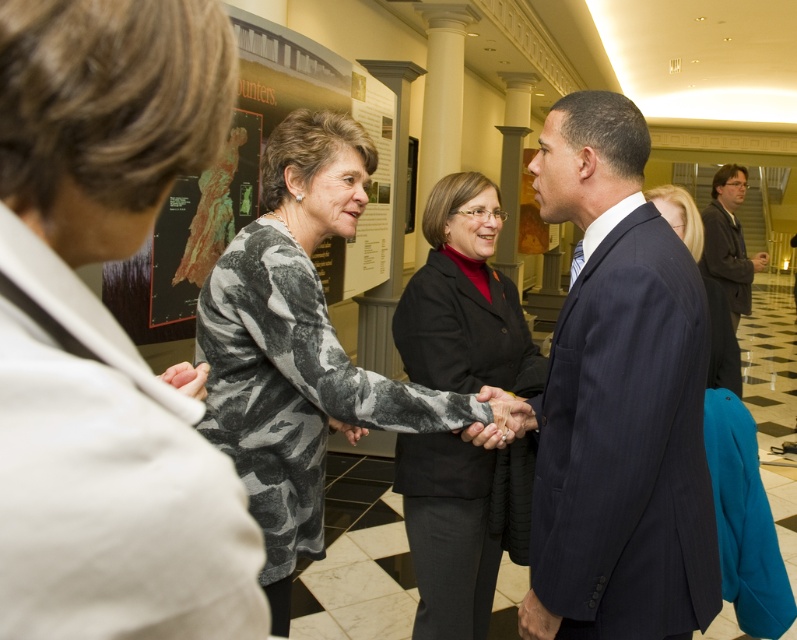
Between camouflage-patterned dress at center and matte paper poster at upper left, which one is positioned higher?

Positioned higher is matte paper poster at upper left.

Consider the image. Can you confirm if camouflage-patterned dress at center is bigger than matte paper poster at upper left?

No, camouflage-patterned dress at center is not bigger than matte paper poster at upper left.

Locate an element on the screen. This screenshot has width=797, height=640. camouflage-patterned dress at center is located at coordinates click(297, 346).

Locate an element on the screen. camouflage-patterned dress at center is located at coordinates (297, 346).

The width and height of the screenshot is (797, 640). Find the location of `camouflage-patterned dress at center`. camouflage-patterned dress at center is located at coordinates (297, 346).

Does camouflage-patterned dress at center appear on the left side of black wool coat at center?

Correct, you'll find camouflage-patterned dress at center to the left of black wool coat at center.

Is point (330, 138) positioned after point (729, 381)?

No, (330, 138) is in front of (729, 381).

The image size is (797, 640). What are the coordinates of `camouflage-patterned dress at center` in the screenshot? It's located at (297, 346).

Describe the element at coordinates (105, 332) in the screenshot. I see `dark blue suit at center` at that location.

Does dark blue suit at center appear on the left side of camouflage-patterned dress at center?

In fact, dark blue suit at center is to the right of camouflage-patterned dress at center.

Consider the image. Measure the distance between dark blue suit at center and camera.

dark blue suit at center and camera are 10.91 inches apart from each other.

Find the location of `dark blue suit at center`. dark blue suit at center is located at coordinates (105, 332).